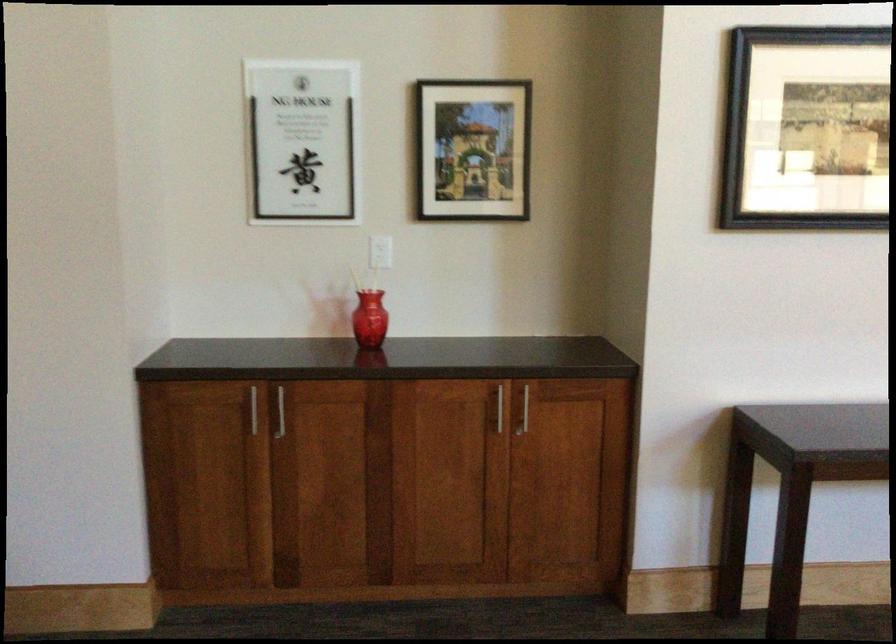
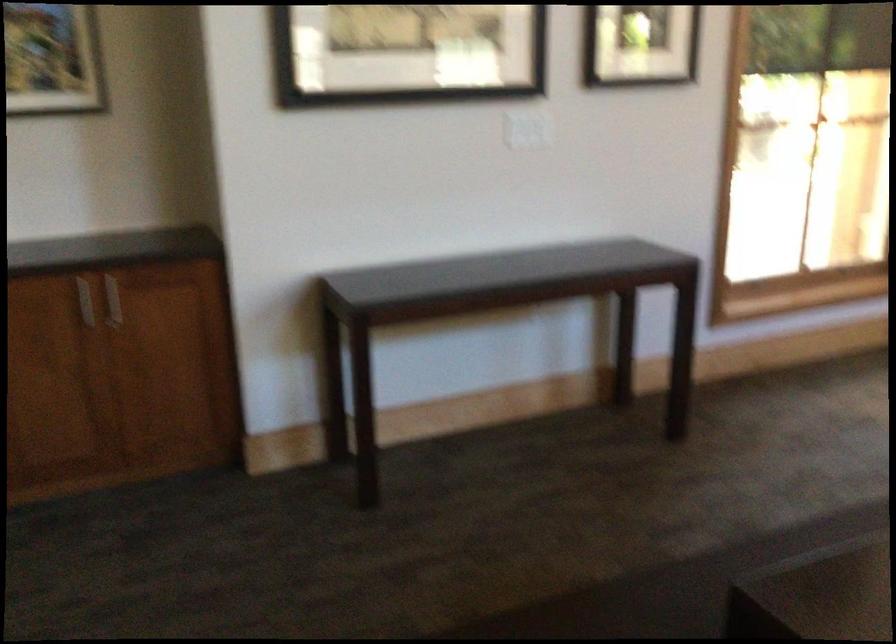
Which direction would the cameraman need to move to produce the second image?

The cameraman moved toward right, backward.